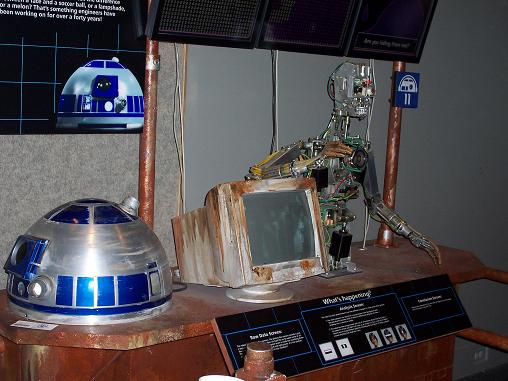
Locate an element on the screen. The width and height of the screenshot is (508, 381). monitor stand is located at coordinates (264, 294).